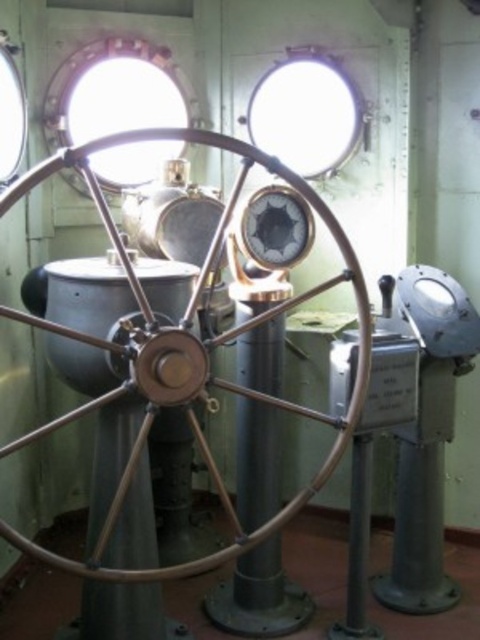
Question: Estimate the real-world distances between objects in this image. Which object is farther from the polished brass wheel at center?

Choices:
 (A) clear glass window at upper center
 (B) clear glass porthole at upper left

Answer: (B)

Question: Observing the image, what is the correct spatial positioning of clear glass porthole at upper left in reference to clear glass window at upper center?

Choices:
 (A) below
 (B) above

Answer: (A)

Question: Does polished brass wheel at center appear on the right side of clear glass porthole at upper left?

Choices:
 (A) no
 (B) yes

Answer: (B)

Question: Which point is farther from the camera taking this photo?

Choices:
 (A) (291, 180)
 (B) (96, 74)
 (C) (327, 72)

Answer: (B)

Question: Can you confirm if polished brass wheel at center is positioned to the right of clear glass window at upper center?

Choices:
 (A) yes
 (B) no

Answer: (B)

Question: Among these objects, which one is farthest from the camera?

Choices:
 (A) polished brass wheel at center
 (B) clear glass porthole at upper left

Answer: (B)